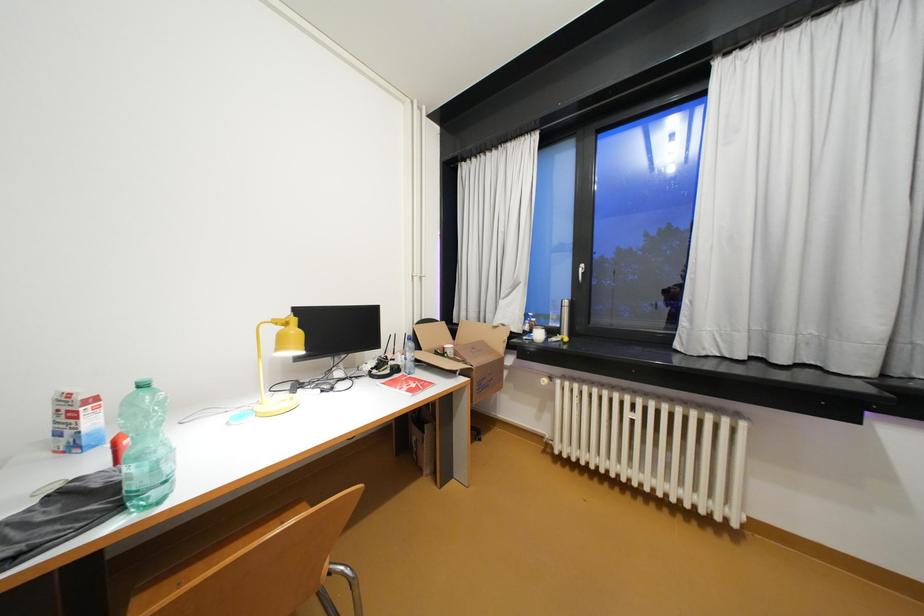
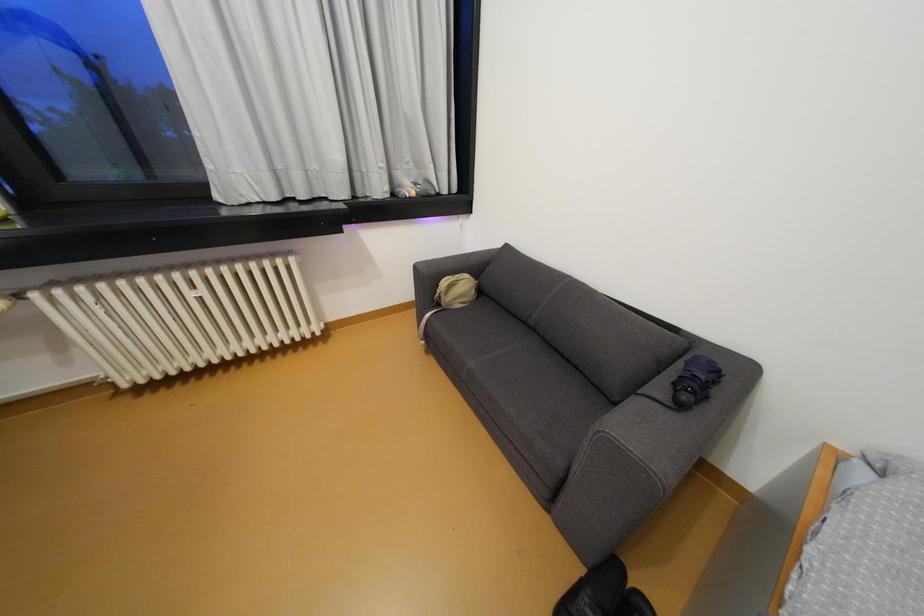
The images are taken continuously from a first-person perspective. In which direction is your viewpoint rotating?

The camera rotated toward right-down.